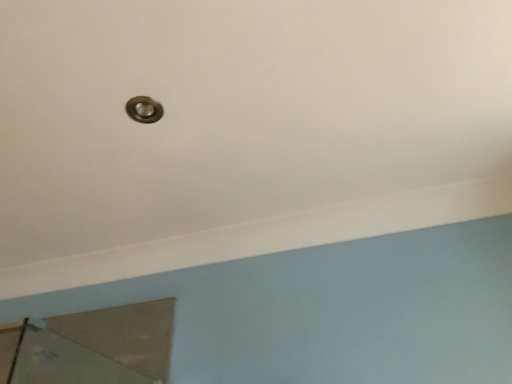
Describe the element at coordinates (144, 109) in the screenshot. The width and height of the screenshot is (512, 384). I see `metallic silver door handle at upper center` at that location.

Locate an element on the screen. The image size is (512, 384). metallic silver door handle at upper center is located at coordinates (144, 109).

Where is `metallic silver door handle at upper center`? metallic silver door handle at upper center is located at coordinates (144, 109).